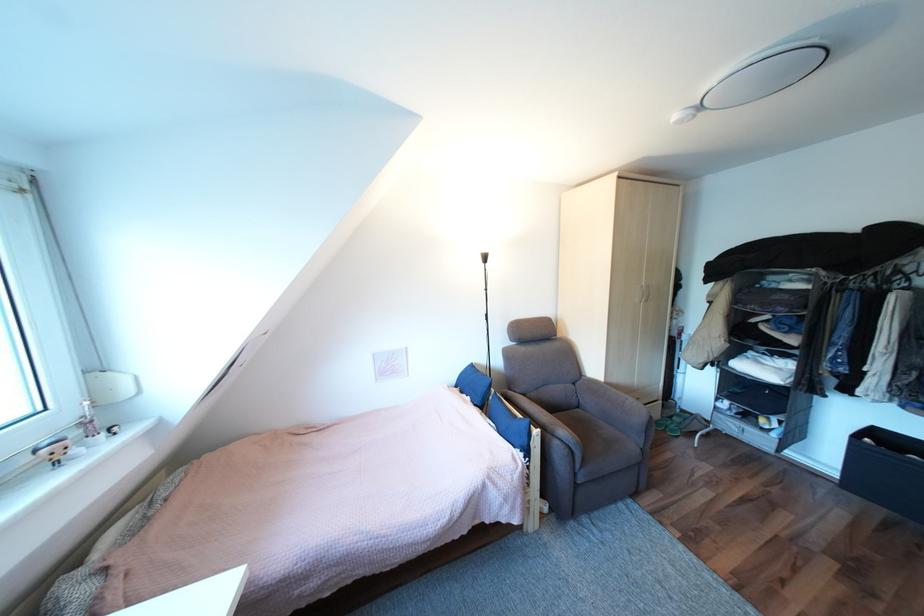
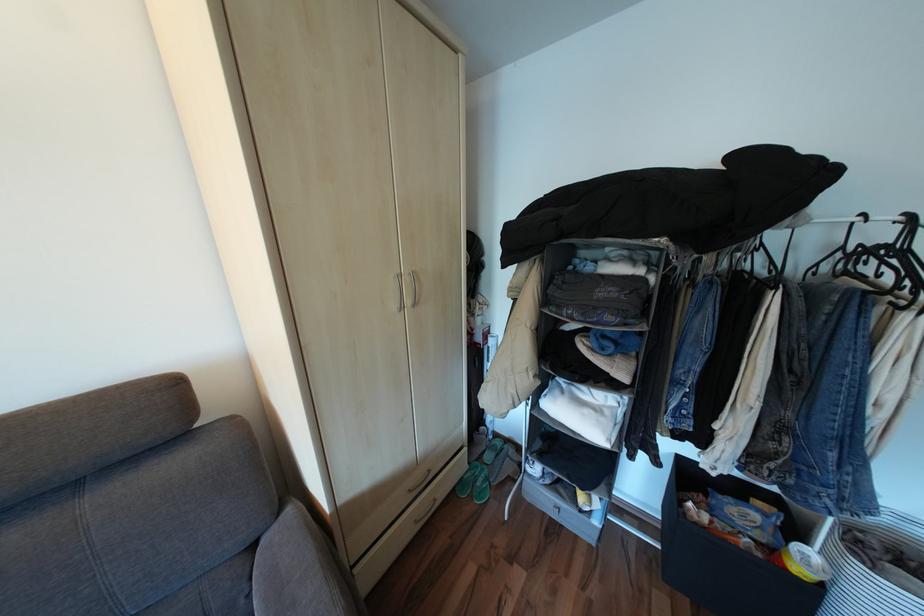
Where in the second image is the point corresponding to pixel 585 384 from the first image?

(263, 545)